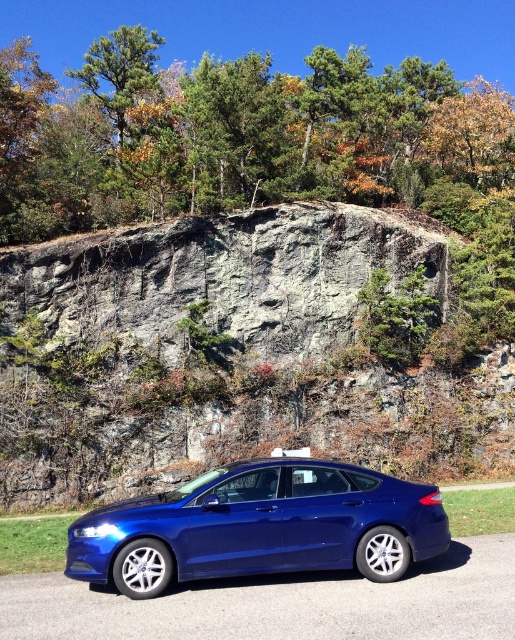
Question: Is green leafy tree at upper center positioned behind metallic blue car at center?

Choices:
 (A) yes
 (B) no

Answer: (A)

Question: Which of the following is the closest to the observer?

Choices:
 (A) green leafy tree at upper center
 (B) metallic blue car at center
 (C) glossy blue sedan at lower center
 (D) gray rock at center

Answer: (B)

Question: Which of the following is the farthest from the observer?

Choices:
 (A) (301, 269)
 (B) (480, 628)
 (C) (177, 568)

Answer: (A)

Question: Is glossy blue sedan at lower center to the right of metallic blue car at center from the viewer's perspective?

Choices:
 (A) no
 (B) yes

Answer: (A)

Question: Estimate the real-world distances between objects in this image. Which object is farther from the gray rock at center?

Choices:
 (A) glossy blue sedan at lower center
 (B) green leafy tree at upper center

Answer: (A)

Question: Can you confirm if green leafy tree at upper center is wider than glossy blue sedan at lower center?

Choices:
 (A) no
 (B) yes

Answer: (B)